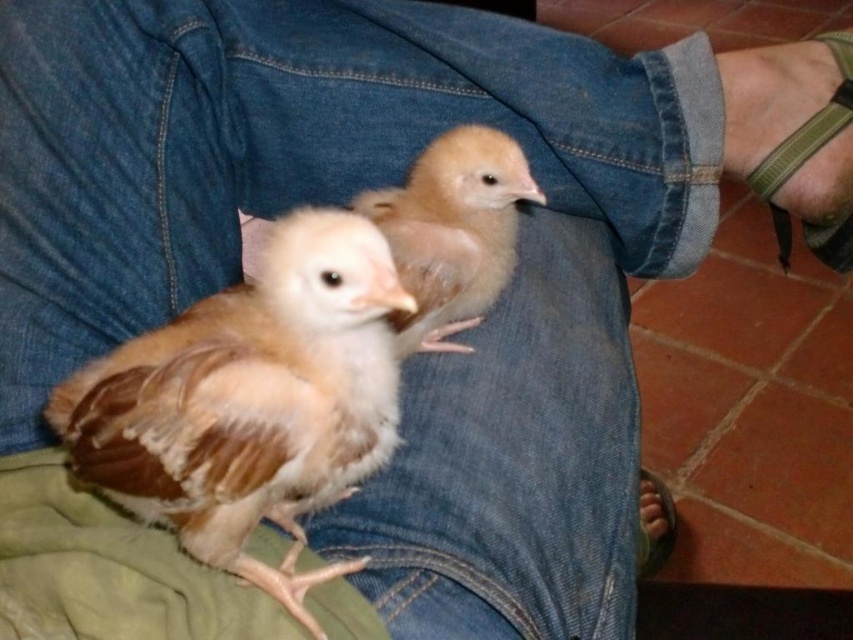
Consider the image. You are a photographer trying to capture a closeup of the green fabric strap at lower right and the brown leather foot at lower right. Which object will appear wider in the photo?

The green fabric strap at lower right will appear wider in the photo because its width is larger than the brown leather foot at lower right.

In the scene shown: You are a photographer trying to capture a closeup of the light brown fluffy chick at center without including the green fabric strap at lower right in the frame. Based on their positions, can you position yourself in a way to achieve this?

The light brown fluffy chick at center is to the left of the green fabric strap at lower right, so moving to the left side of the scene would allow you to frame the chick without including the strap.

You are a photographer trying to capture a closeup of the point at coordinates point (848, 164). Your camera has a focal length of 50mm and a sensor size of 24mm x 36mm. What is the minimum distance you need to move the camera forward to ensure the point fills the frame vertically?

The point at coordinates point (848, 164) is 32.13 inches from the camera. To fill the frame vertically, the distance should be calculated using the formula distance equals sensor height divided by two times tangent of half the field of view. However, since the point is a single coordinate, the minimum distance required would be when the sensor height matches the point distance, so moving the camera closer until the distance is 32.13 inches or less would ensure the point fills the frame.